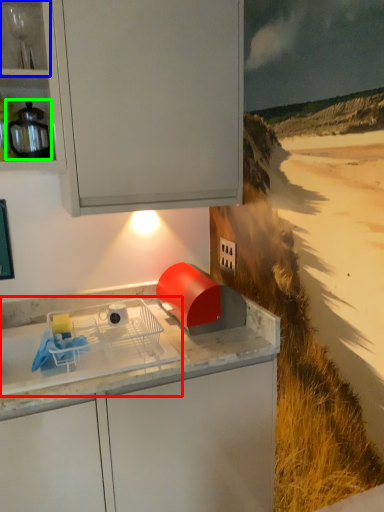
Question: Which object is the closest to the home appliance (highlighted by a red box)? Choose among these: shelf (highlighted by a blue box) or kitchen appliance (highlighted by a green box).

Choices:
 (A) shelf
 (B) kitchen appliance

Answer: (B)